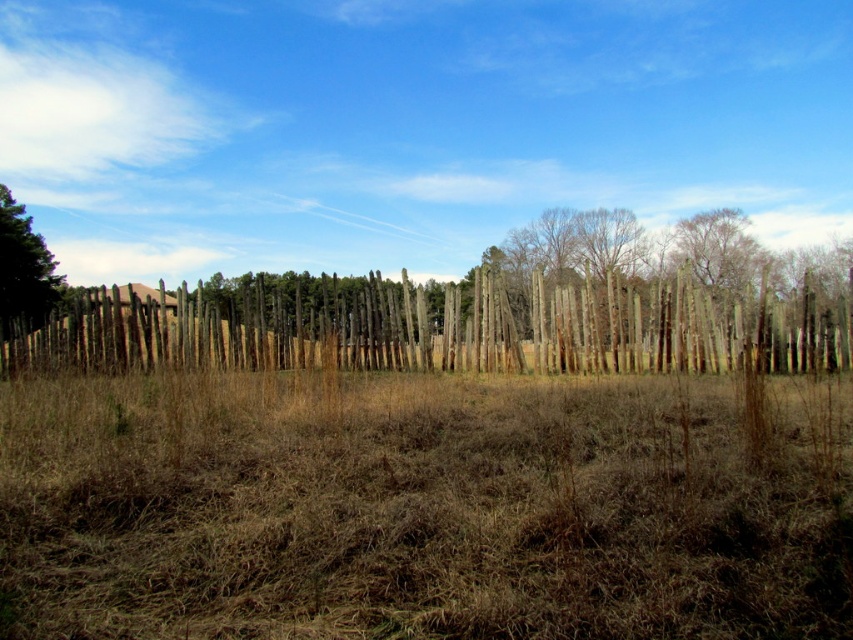
Question: Considering the real-world distances, which object is closest to the brown dry grass at center?

Choices:
 (A) green textured tree at left
 (B) wooden fence at center

Answer: (B)

Question: Where is brown dry grass at center located in relation to green textured tree at left in the image?

Choices:
 (A) above
 (B) below

Answer: (B)

Question: Is wooden fence at center to the left of green textured tree at left from the viewer's perspective?

Choices:
 (A) yes
 (B) no

Answer: (B)

Question: Which object is positioned closest to the green textured tree at left?

Choices:
 (A) brown dry grass at center
 (B) wooden fence at center

Answer: (B)

Question: Considering the real-world distances, which object is closest to the brown dry grass at center?

Choices:
 (A) green textured tree at left
 (B) wooden fence at center

Answer: (B)

Question: Is wooden fence at center bigger than green textured tree at left?

Choices:
 (A) no
 (B) yes

Answer: (B)